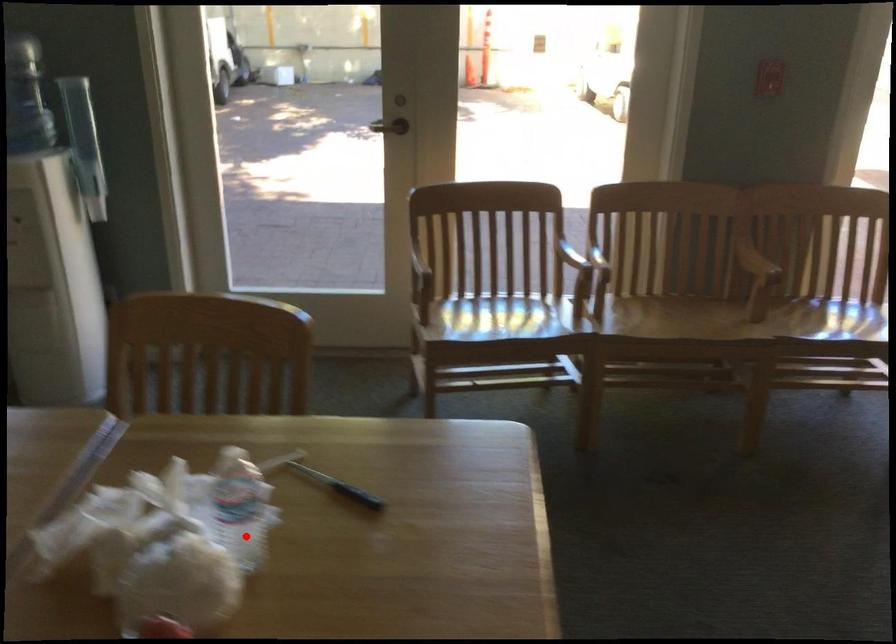
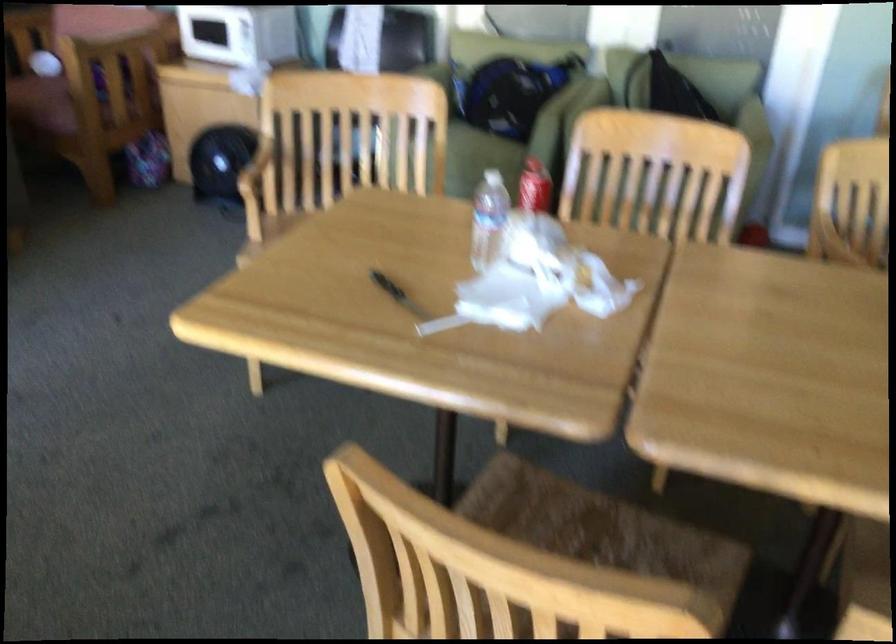
In the second image, find the point that corresponds to the highlighted location in the first image.

(398, 294)